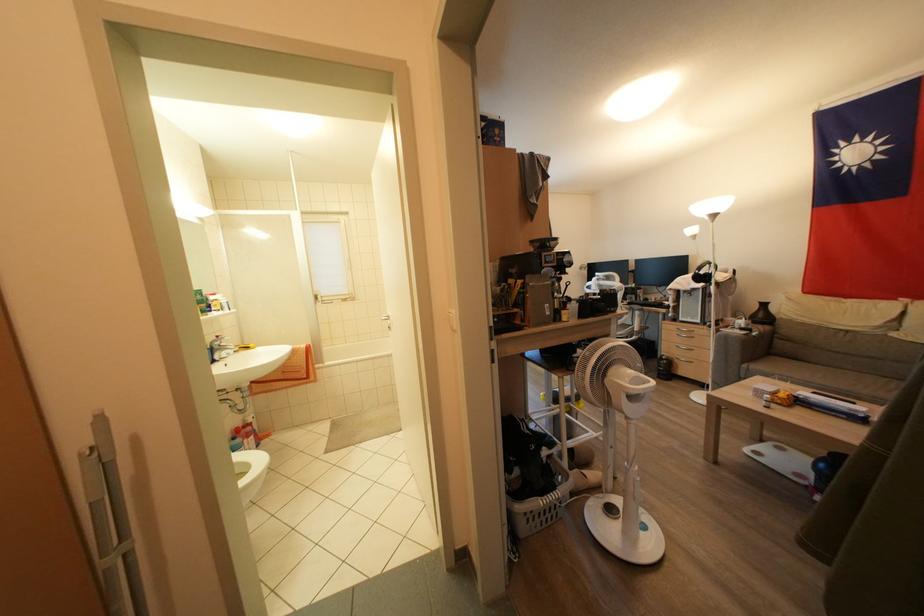
Where is `white laundry basket`? The height and width of the screenshot is (616, 924). white laundry basket is located at coordinates (541, 505).